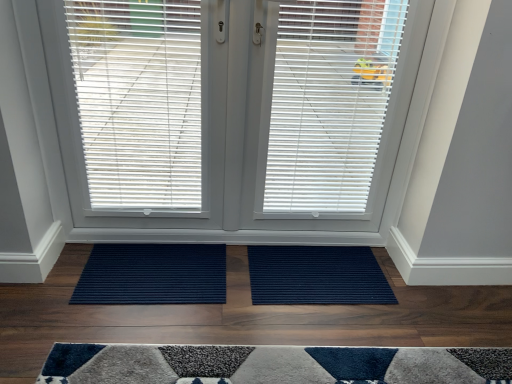
Question: Can you confirm if white matte window blind at center, placed as the first window blind when sorted from right to left, is shorter than white matte window blind at center, the second window blind viewed from the right?

Choices:
 (A) no
 (B) yes

Answer: (B)

Question: Is white matte window blind at center, placed as the 3th window blind when sorted from left to right, not close to white matte window blind at center, the second window blind viewed from the right?

Choices:
 (A) yes
 (B) no

Answer: (B)

Question: Is white matte window blind at center, placed as the first window blind when sorted from right to left, outside of white matte window blind at center, the 2th window blind when ordered from left to right?

Choices:
 (A) yes
 (B) no

Answer: (B)

Question: Does white matte window blind at center, placed as the first window blind when sorted from right to left, have a greater height compared to white matte window blind at center, the second window blind viewed from the right?

Choices:
 (A) no
 (B) yes

Answer: (A)

Question: From the image's perspective, is white matte window blind at center, placed as the first window blind when sorted from right to left, under white matte window blind at center, the second window blind viewed from the right?

Choices:
 (A) no
 (B) yes

Answer: (B)

Question: Is white plastic blinds at center, the 1th window blind in the left-to-right sequence, in front of or behind white matte window blind at center, the 2th window blind when ordered from left to right, in the image?

Choices:
 (A) front
 (B) behind

Answer: (B)

Question: From a real-world perspective, is white plastic blinds at center, the 3th window blind in the right-to-left sequence, physically located above or below white matte window blind at center, the 2th window blind when ordered from left to right?

Choices:
 (A) below
 (B) above

Answer: (A)

Question: Based on their sizes in the image, would you say white plastic blinds at center, the 3th window blind in the right-to-left sequence, is bigger or smaller than white matte window blind at center, the 2th window blind when ordered from left to right?

Choices:
 (A) small
 (B) big

Answer: (A)

Question: In terms of height, does white plastic blinds at center, the 1th window blind in the left-to-right sequence, look taller or shorter compared to white matte window blind at center, the second window blind viewed from the right?

Choices:
 (A) tall
 (B) short

Answer: (B)

Question: Visually, is white plastic blinds at center, the 1th window blind in the left-to-right sequence, positioned to the left or to the right of white matte window blind at center, placed as the 3th window blind when sorted from left to right?

Choices:
 (A) left
 (B) right

Answer: (A)

Question: From the image's perspective, is white plastic blinds at center, the 1th window blind in the left-to-right sequence, above or below white matte window blind at center, placed as the first window blind when sorted from right to left?

Choices:
 (A) below
 (B) above

Answer: (B)

Question: From a real-world perspective, is white plastic blinds at center, the 1th window blind in the left-to-right sequence, positioned above or below white matte window blind at center, placed as the first window blind when sorted from right to left?

Choices:
 (A) below
 (B) above

Answer: (A)

Question: Is white plastic blinds at center, the 1th window blind in the left-to-right sequence, wider or thinner than white matte window blind at center, placed as the 3th window blind when sorted from left to right?

Choices:
 (A) wide
 (B) thin

Answer: (B)

Question: In terms of height, does white plastic blinds at center, the 1th window blind in the left-to-right sequence, look taller or shorter compared to navy blue ribbed mat at center, placed as the 2th doormat when sorted from left to right?

Choices:
 (A) short
 (B) tall

Answer: (B)

Question: From a real-world perspective, is white plastic blinds at center, the 1th window blind in the left-to-right sequence, physically located above or below navy blue ribbed mat at center, placed as the 2th doormat when sorted from left to right?

Choices:
 (A) above
 (B) below

Answer: (A)